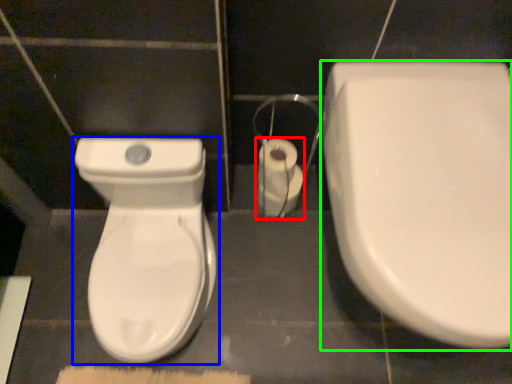
Question: Which is farther away from toilet paper (highlighted by a red box)? toilet (highlighted by a blue box) or toilet (highlighted by a green box)?

Choices:
 (A) toilet
 (B) toilet

Answer: (B)